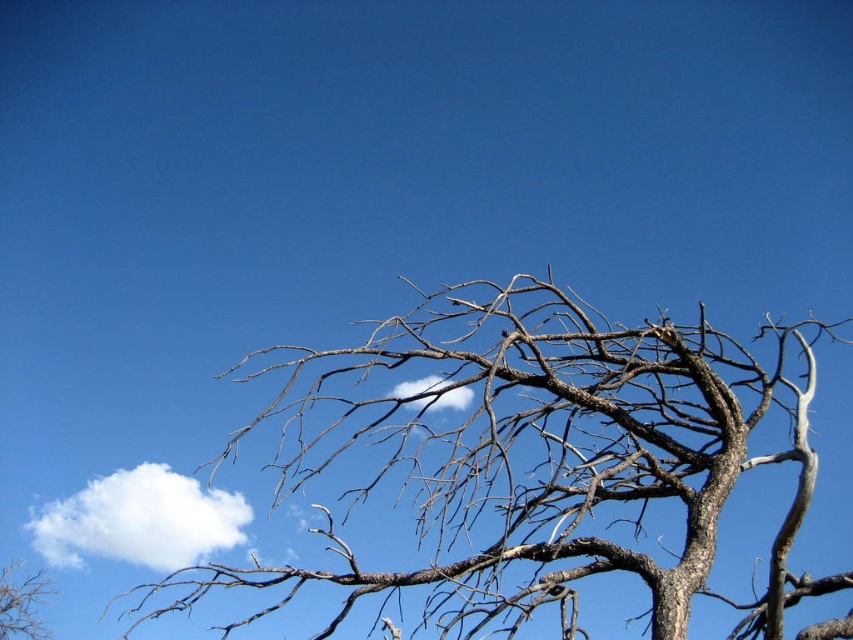
You are an artist holding a 100 cm long paintbrush. You want to paint both the brown rough tree at center and the white fluffy cloud at center without moving your hand. Can you reach both objects with your paintbrush?

The brown rough tree at center and white fluffy cloud at center are 87.34 centimeters apart. Since the distance between them is less than the length of your 100 cm paintbrush, you can reach both objects without moving your hand.

You are an artist trying to paint the scene. You need to decide which object to sketch first based on their sizes. Which one should you start with, the brown rough tree at center or the white fluffy cloud at center?

The brown rough tree at center is wider than the white fluffy cloud at center, so you should start with the brown rough tree at center as it occupies more space in the scene.

You are an artist trying to paint the scene. You have a 75 cm wide canvas. Can you fit both the white fluffy cloud at upper left and the brown rough tree at lower left on the canvas without overlapping?

The distance between the white fluffy cloud at upper left and the brown rough tree at lower left is 77.06 centimeters. Since the canvas is only 75 cm wide, they cannot be placed side by side without overlapping.